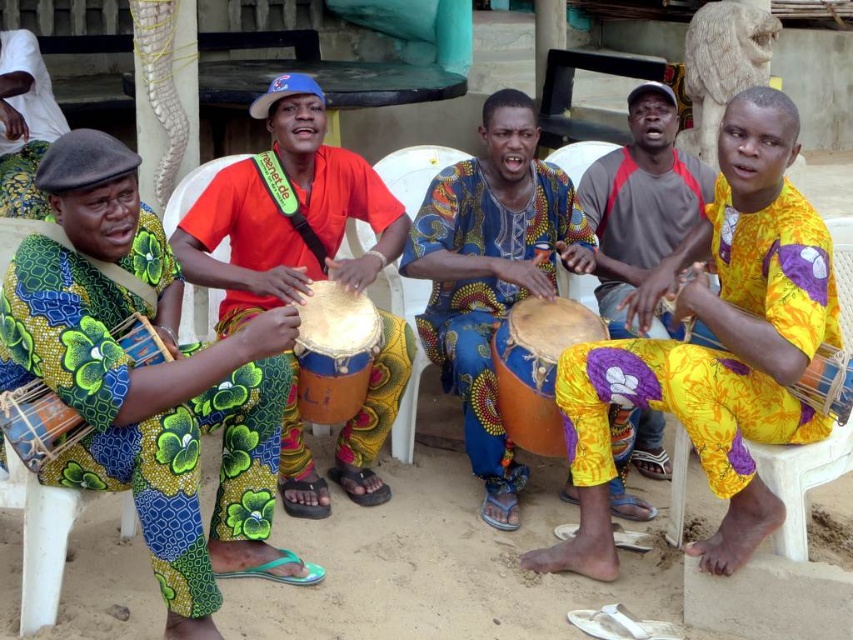
Between orange fabric drum at center and orange drum at center, which one appears on the right side from the viewer's perspective?

Positioned to the right is orange drum at center.

Does orange fabric drum at center have a larger size compared to orange drum at center?

Yes, orange fabric drum at center is bigger than orange drum at center.

What do you see at coordinates (287, 212) in the screenshot? I see `orange fabric drum at center` at bounding box center [287, 212].

Where is `orange fabric drum at center`? The height and width of the screenshot is (640, 853). orange fabric drum at center is located at coordinates (287, 212).

In the scene shown: Is blue patterned cloth at center closer to camera compared to matte wooden drum at center?

No.

Is point (486, 234) closer to camera compared to point (573, 310)?

No, (486, 234) is behind (573, 310).

In order to click on blue patterned cloth at center in this screenshot , I will do `click(491, 273)`.

Who is more distant from viewer, (538, 424) or (332, 292)?

The point (332, 292) is more distant.

Is matte wooden drum at center smaller than orange drum at center?

No.

This screenshot has width=853, height=640. Find the location of `matte wooden drum at center`. matte wooden drum at center is located at coordinates click(537, 365).